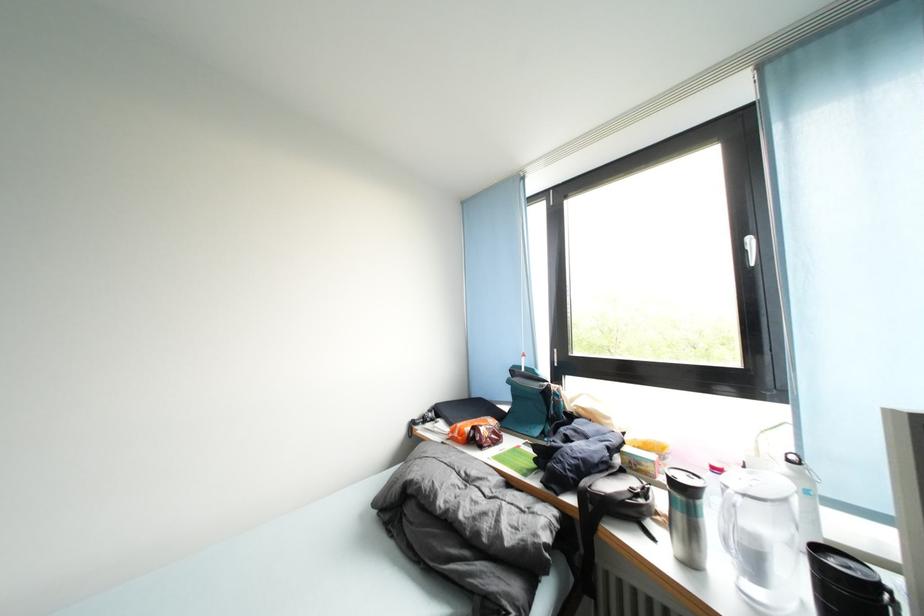
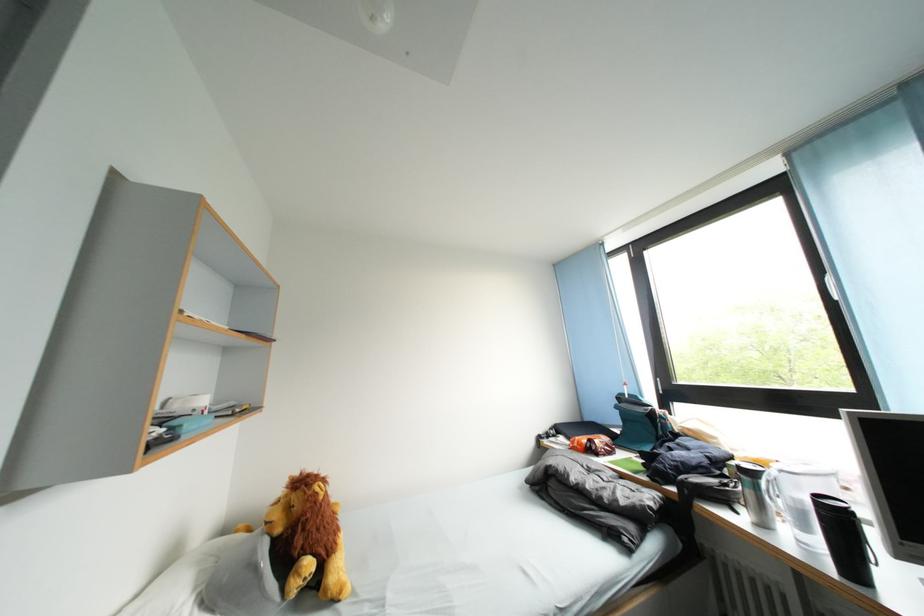
Question: The images are taken continuously from a first-person perspective. In which direction is your viewpoint rotating?

Choices:
 (A) Left
 (B) Right
 (C) Up
 (D) Down

Answer: (A)